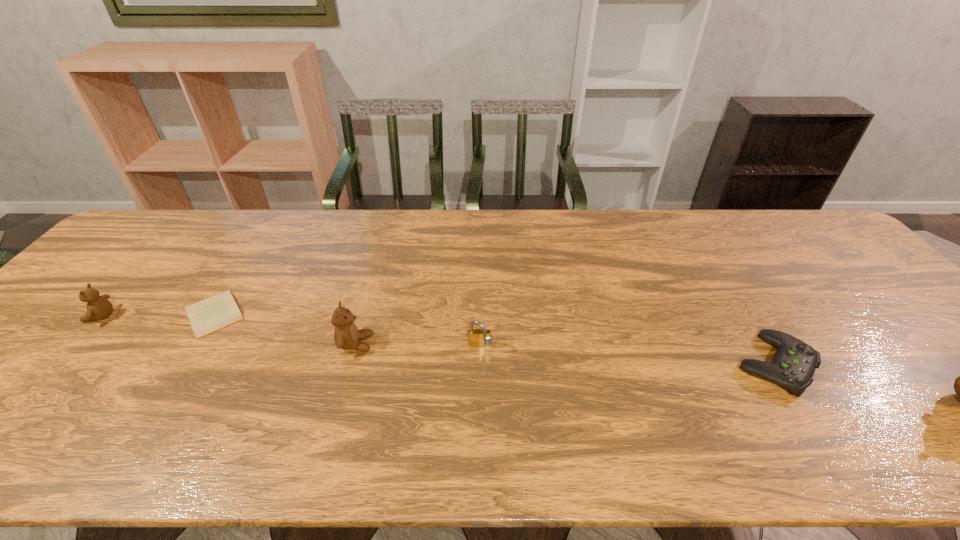
Where is `free point that keeps the teddy bears evenly spaced on the right`? free point that keeps the teddy bears evenly spaced on the right is located at coordinates (647, 375).